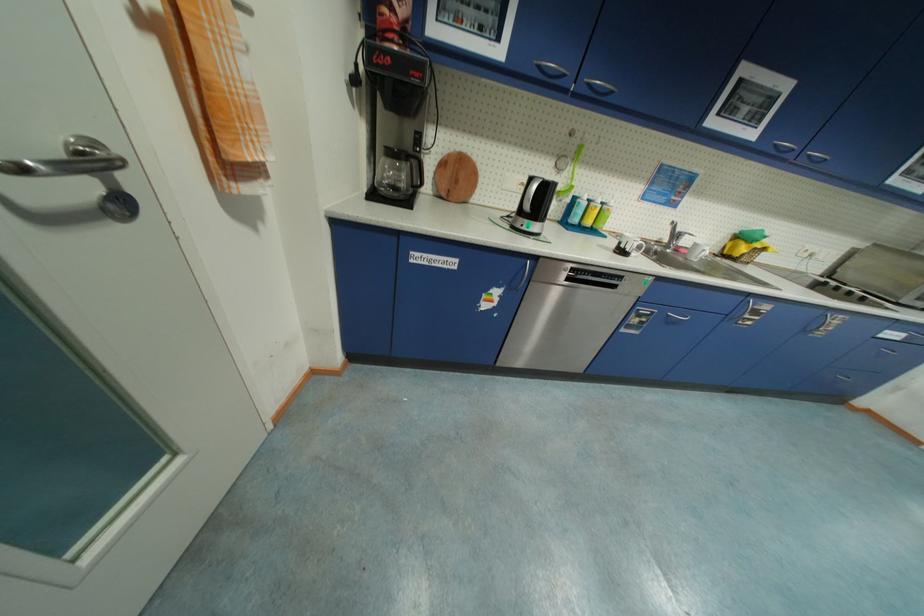
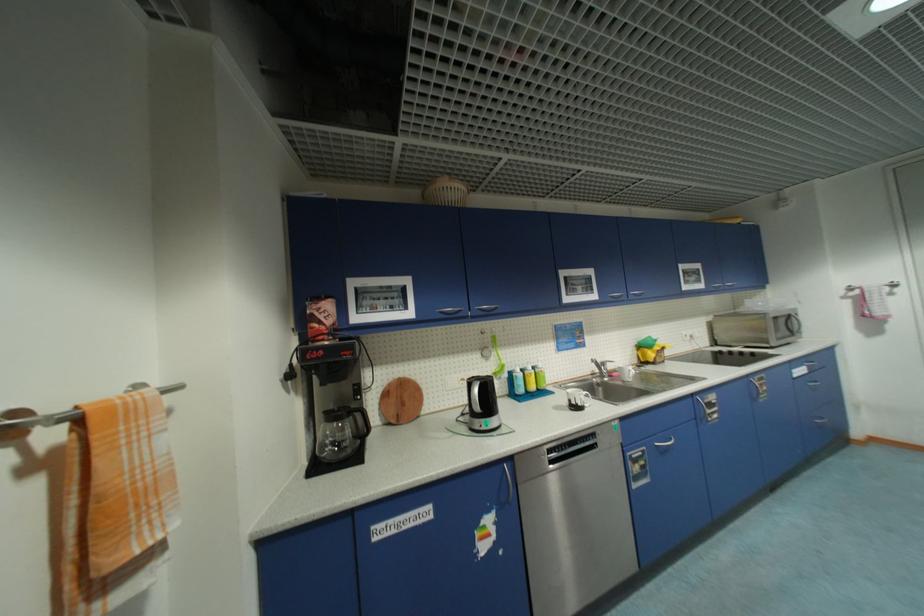
Based on the photo, how did the camera likely rotate?

The rotation direction of the camera is right-up.